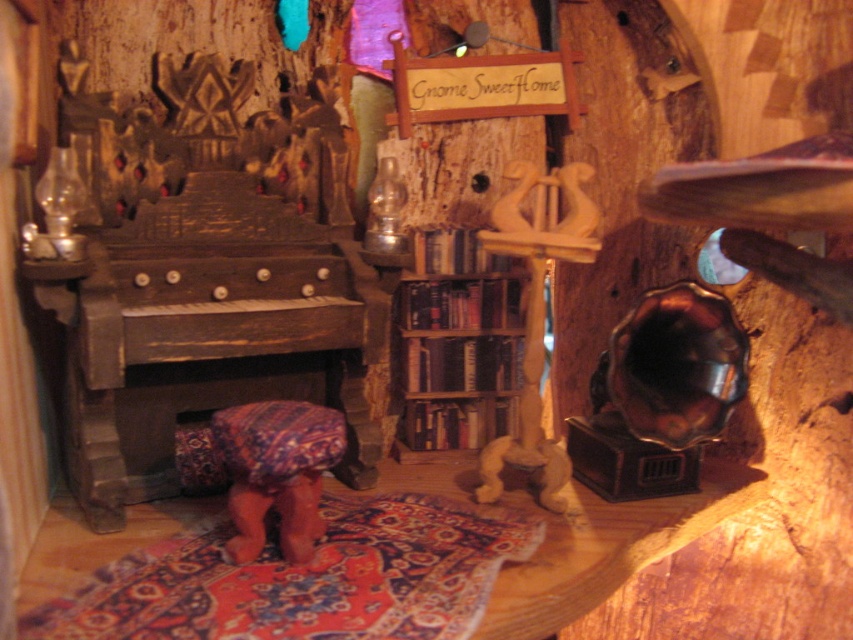
Between wooden bookshelf at center and patterned fabric stool at center, which one is positioned higher?

wooden bookshelf at center is above.

Can you confirm if wooden bookshelf at center is smaller than patterned fabric stool at center?

No, wooden bookshelf at center is not smaller than patterned fabric stool at center.

Find the location of a particular element. The height and width of the screenshot is (640, 853). wooden bookshelf at center is located at coordinates (457, 362).